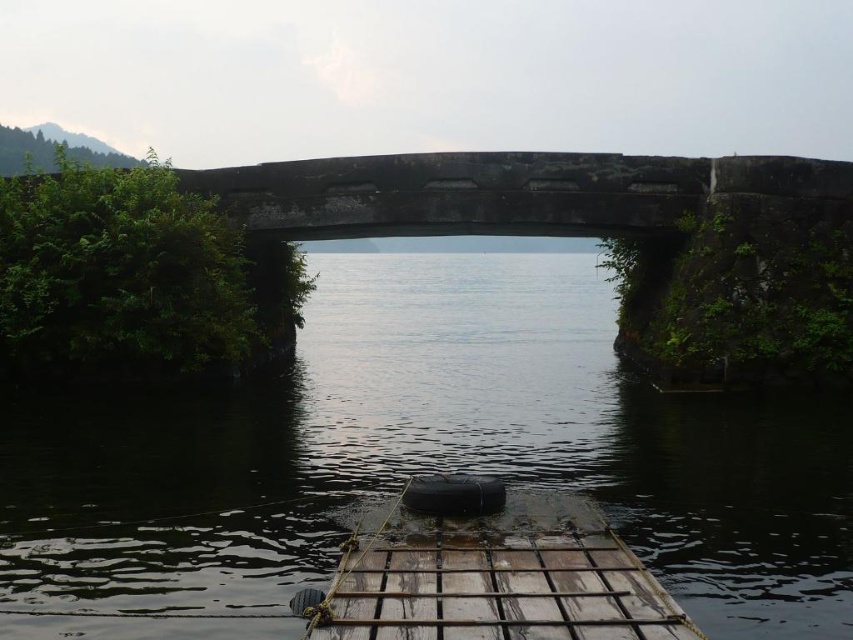
Question: Does black rubber boat at center appear over wooden planks boat at center?

Choices:
 (A) no
 (B) yes

Answer: (B)

Question: Among these points, which one is nearest to the camera?

Choices:
 (A) (436, 362)
 (B) (601, 541)

Answer: (B)

Question: Which point appears farthest from the camera in this image?

Choices:
 (A) (802, 540)
 (B) (341, 580)

Answer: (A)

Question: Can you confirm if black rubber boat at center is thinner than wooden planks boat at center?

Choices:
 (A) yes
 (B) no

Answer: (B)

Question: Does black rubber boat at center appear on the right side of wooden planks boat at center?

Choices:
 (A) yes
 (B) no

Answer: (B)